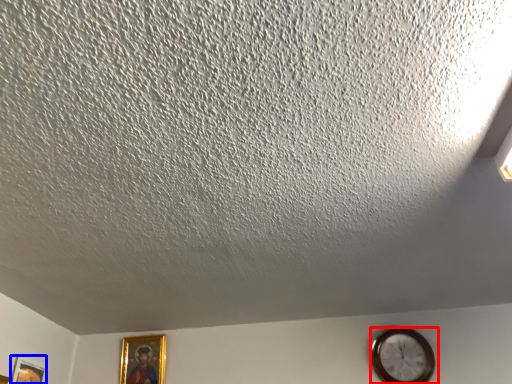
Question: Among these objects, which one is nearest to the camera, wall clock (highlighted by a red box) or picture frame (highlighted by a blue box)?

Choices:
 (A) wall clock
 (B) picture frame

Answer: (B)